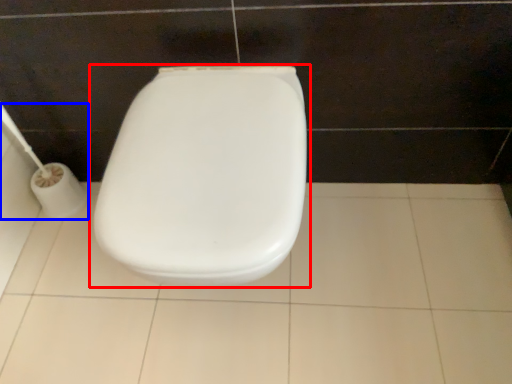
Question: Which object is further to the camera taking this photo, toilet (highlighted by a red box) or toilet paper (highlighted by a blue box)?

Choices:
 (A) toilet
 (B) toilet paper

Answer: (B)